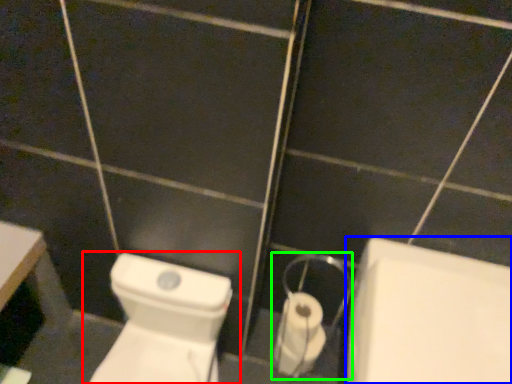
Question: Which object is positioned farthest from toilet (highlighted by a red box)? Select from bath (highlighted by a blue box) and dispenser (highlighted by a green box).

Choices:
 (A) bath
 (B) dispenser

Answer: (A)